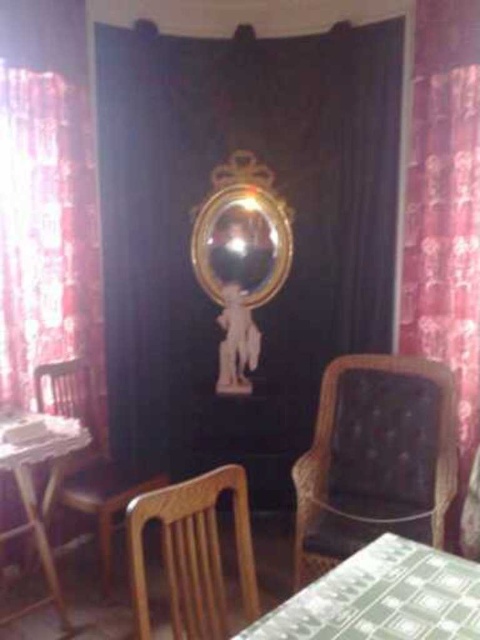
Is gold reflective mirror at center below wooden table at left?

Incorrect, gold reflective mirror at center is not positioned below wooden table at left.

Between gold reflective mirror at center and wooden table at left, which one is positioned lower?

wooden table at left is below.

At what (x,y) coordinates should I click in order to perform the action: click on gold reflective mirror at center. Please return your answer as a coordinate pair (x, y). This screenshot has width=480, height=640. Looking at the image, I should click on (241, 241).

You are a GUI agent. You are given a task and a screenshot of the screen. Output one action in this format:
    pyautogui.click(x=<x>, y=<y>)
    Task: Click on the gold reflective mirror at center
    Image resolution: width=480 pixels, height=640 pixels.
    Given the screenshot: What is the action you would take?
    pyautogui.click(x=241, y=241)

Which is in front, point (67, 298) or point (252, 260)?

Positioned in front is point (67, 298).

Is red floral curtain at left to the right of gold reflective mirror at center from the viewer's perspective?

Incorrect, red floral curtain at left is not on the right side of gold reflective mirror at center.

Is point (96, 356) in front of point (252, 186)?

That is True.

This screenshot has width=480, height=640. In order to click on red floral curtain at left in this screenshot , I will do `click(47, 234)`.

Can you confirm if velvet burgundy curtain at right is positioned below wooden chair at center?

No.

Measure the distance between point (417,184) and camera.

3.05 meters

Identify the location of velvet burgundy curtain at right. The height and width of the screenshot is (640, 480). (444, 211).